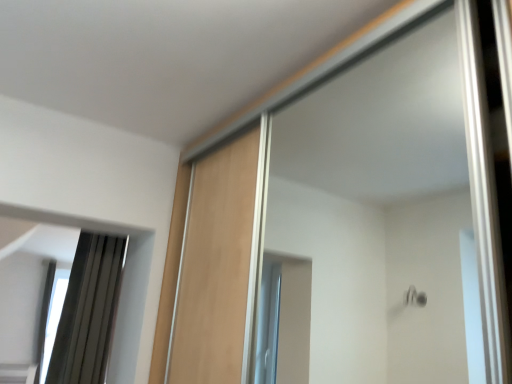
Question: Is matte gray curtain at left wider than transparent glass window at lower left?

Choices:
 (A) yes
 (B) no

Answer: (B)

Question: Is the depth of matte gray curtain at left less than that of transparent glass window at lower left?

Choices:
 (A) no
 (B) yes

Answer: (B)

Question: Considering the relative sizes of matte gray curtain at left and transparent glass window at lower left in the image provided, is matte gray curtain at left thinner than transparent glass window at lower left?

Choices:
 (A) no
 (B) yes

Answer: (B)

Question: From a real-world perspective, does matte gray curtain at left stand above transparent glass window at lower left?

Choices:
 (A) yes
 (B) no

Answer: (A)

Question: Considering the relative sizes of matte gray curtain at left and transparent glass window at lower left in the image provided, is matte gray curtain at left taller than transparent glass window at lower left?

Choices:
 (A) yes
 (B) no

Answer: (B)

Question: From the image's perspective, is matte gray curtain at left on transparent glass window at lower left?

Choices:
 (A) no
 (B) yes

Answer: (B)

Question: Considering the relative sizes of transparent glass window at lower left and matte gray curtain at left in the image provided, is transparent glass window at lower left taller than matte gray curtain at left?

Choices:
 (A) yes
 (B) no

Answer: (A)

Question: Is transparent glass window at lower left outside matte gray curtain at left?

Choices:
 (A) yes
 (B) no

Answer: (A)

Question: Would you consider transparent glass window at lower left to be distant from matte gray curtain at left?

Choices:
 (A) no
 (B) yes

Answer: (A)

Question: Can you confirm if transparent glass window at lower left is wider than matte gray curtain at left?

Choices:
 (A) no
 (B) yes

Answer: (B)

Question: Can you confirm if transparent glass window at lower left is shorter than matte gray curtain at left?

Choices:
 (A) yes
 (B) no

Answer: (B)

Question: Is transparent glass window at lower left closer to the viewer compared to matte gray curtain at left?

Choices:
 (A) no
 (B) yes

Answer: (A)

Question: Is transparent glass window at lower left bigger or smaller than matte gray curtain at left?

Choices:
 (A) big
 (B) small

Answer: (A)